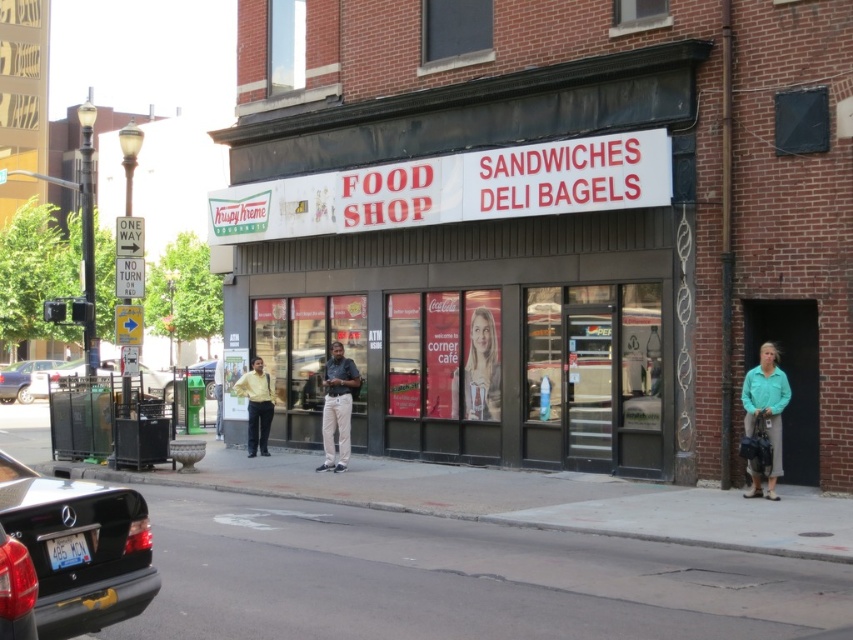
Which is more to the right, black matte sedan at lower left or silver metallic car at left?

black matte sedan at lower left

From the picture: Is black matte sedan at lower left wider than silver metallic car at left?

No, black matte sedan at lower left is not wider than silver metallic car at left.

Find the location of a particular element. black matte sedan at lower left is located at coordinates (79, 547).

At what (x,y) coordinates should I click in order to perform the action: click on black matte sedan at lower left. Please return your answer as a coordinate pair (x, y). This screenshot has width=853, height=640. Looking at the image, I should click on (79, 547).

In the scene shown: Which of these two, matte black food shop at center or silver metallic car at left, stands taller?

Standing taller between the two is matte black food shop at center.

Does point (616, 212) lie behind point (45, 385)?

That is False.

I want to click on matte black food shop at center, so click(490, 253).

From the picture: Can you confirm if silver metallic car at left is positioned below metallic silver sedan at lower left?

Yes, silver metallic car at left is below metallic silver sedan at lower left.

Does point (146, 392) come behind point (53, 362)?

No, (146, 392) is in front of (53, 362).

Who is more distant from viewer, (39, 380) or (24, 380)?

Point (39, 380)

This screenshot has height=640, width=853. What are the coordinates of `silver metallic car at left` in the screenshot? It's located at (53, 378).